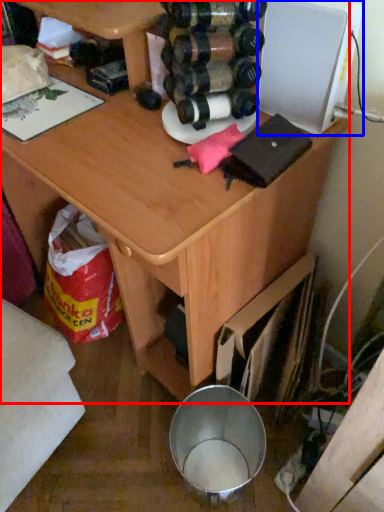
Question: Which object appears farthest to the camera in this image, desk (highlighted by a red box) or appliance (highlighted by a blue box)?

Choices:
 (A) desk
 (B) appliance

Answer: (B)